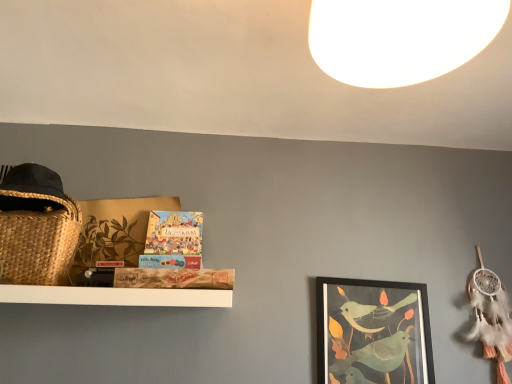
At what (x,y) coordinates should I click in order to perform the action: click on blank space situated above matte black picture frame at center right (from a real-world perspective). Please return your answer as a coordinate pair (x, y). Looking at the image, I should click on (364, 278).